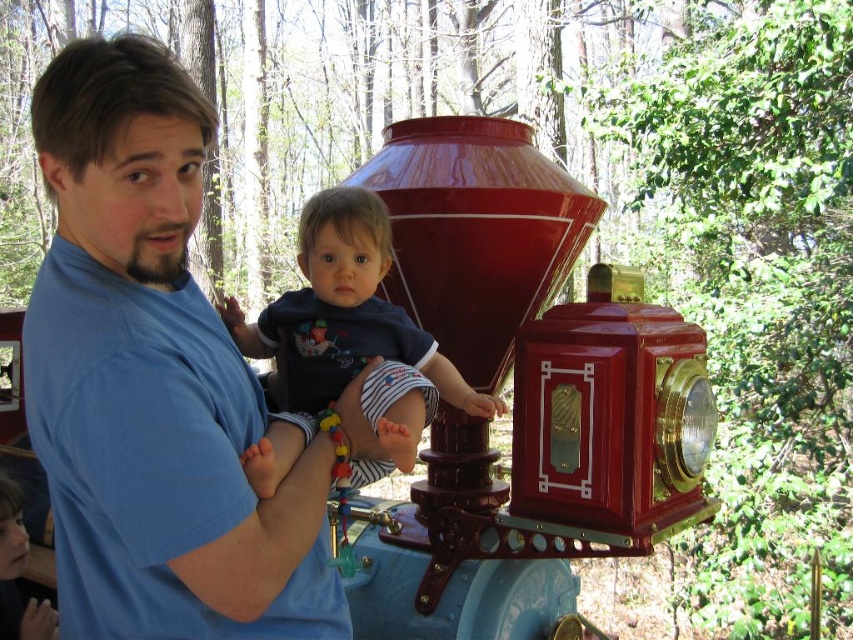
Question: Which point appears closest to the camera in this image?

Choices:
 (A) (94, 504)
 (B) (431, 413)

Answer: (A)

Question: Is blue cotton shirt at center wider than dark blue cotton shirt at center?

Choices:
 (A) yes
 (B) no

Answer: (B)

Question: Which point is farther to the camera?

Choices:
 (A) blue cotton shirt at center
 (B) dark blue cotton shirt at center

Answer: (B)

Question: In this image, where is blue cotton shirt at center located relative to dark blue cotton shirt at center?

Choices:
 (A) below
 (B) above

Answer: (A)

Question: Does blue cotton shirt at center appear under dark blue cotton shirt at center?

Choices:
 (A) yes
 (B) no

Answer: (A)

Question: Which of the following is the closest to the observer?

Choices:
 (A) (151, 106)
 (B) (393, 337)

Answer: (A)